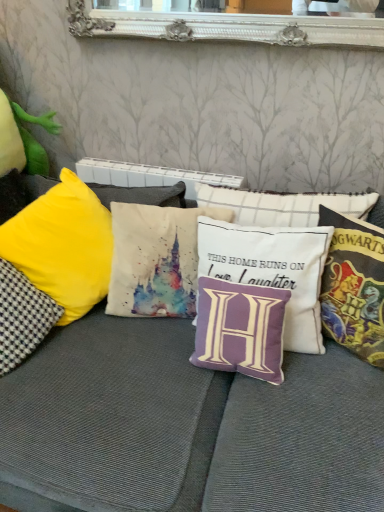
Question: Does watercolor fabric castle at center, the 4th pillow in the right-to-left sequence, contain multicolored fabric hogwarts-themed pillow at right, which ranks as the 5th pillow in left-to-right order?

Choices:
 (A) no
 (B) yes

Answer: (A)

Question: Considering the relative sizes of watercolor fabric castle at center, which is the 2th pillow in left-to-right order, and multicolored fabric hogwarts-themed pillow at right, the first pillow from the right, in the image provided, is watercolor fabric castle at center, which is the 2th pillow in left-to-right order, thinner than multicolored fabric hogwarts-themed pillow at right, the first pillow from the right,?

Choices:
 (A) yes
 (B) no

Answer: (B)

Question: Would you say watercolor fabric castle at center, the 4th pillow in the right-to-left sequence, is a long distance from multicolored fabric hogwarts-themed pillow at right, the first pillow from the right?

Choices:
 (A) no
 (B) yes

Answer: (A)

Question: Is watercolor fabric castle at center, the 4th pillow in the right-to-left sequence, positioned with its back to multicolored fabric hogwarts-themed pillow at right, the first pillow from the right?

Choices:
 (A) no
 (B) yes

Answer: (A)

Question: Is watercolor fabric castle at center, which is the 2th pillow in left-to-right order, outside multicolored fabric hogwarts-themed pillow at right, which ranks as the 5th pillow in left-to-right order?

Choices:
 (A) yes
 (B) no

Answer: (A)

Question: Based on their positions, is purple fabric pillow at center, which is the 2th pillow from right to left, located to the left or right of purple fabric pillow at center, which is the third pillow from right to left?

Choices:
 (A) right
 (B) left

Answer: (A)

Question: From the image's perspective, is purple fabric pillow at center, the 4th pillow positioned from the left, positioned above or below purple fabric pillow at center, which is counted as the 3th pillow, starting from the left?

Choices:
 (A) above
 (B) below

Answer: (A)

Question: Considering the positions of purple fabric pillow at center, the 4th pillow positioned from the left, and purple fabric pillow at center, which is counted as the 3th pillow, starting from the left, in the image, is purple fabric pillow at center, the 4th pillow positioned from the left, taller or shorter than purple fabric pillow at center, which is counted as the 3th pillow, starting from the left,?

Choices:
 (A) short
 (B) tall

Answer: (B)

Question: In terms of size, does purple fabric pillow at center, the 4th pillow positioned from the left, appear bigger or smaller than purple fabric pillow at center, which is counted as the 3th pillow, starting from the left?

Choices:
 (A) big
 (B) small

Answer: (A)

Question: Does point (269, 487) appear closer or farther from the camera than point (231, 260)?

Choices:
 (A) closer
 (B) farther

Answer: (A)

Question: Considering the positions of velvet cushion at center and purple fabric pillow at center, which is the 2th pillow from right to left, in the image, is velvet cushion at center taller or shorter than purple fabric pillow at center, which is the 2th pillow from right to left,?

Choices:
 (A) tall
 (B) short

Answer: (A)

Question: From the image's perspective, is velvet cushion at center located above or below purple fabric pillow at center, the 4th pillow positioned from the left?

Choices:
 (A) below
 (B) above

Answer: (A)

Question: In the image, is velvet cushion at center positioned in front of or behind purple fabric pillow at center, which is the 2th pillow from right to left?

Choices:
 (A) behind
 (B) front

Answer: (B)

Question: Is purple fabric pillow at center, which is counted as the 3th pillow, starting from the left, situated inside velvet cushion at center or outside?

Choices:
 (A) inside
 (B) outside

Answer: (A)

Question: Considering the positions of purple fabric pillow at center, which is counted as the 3th pillow, starting from the left, and velvet cushion at center in the image, is purple fabric pillow at center, which is counted as the 3th pillow, starting from the left, wider or thinner than velvet cushion at center?

Choices:
 (A) wide
 (B) thin

Answer: (B)